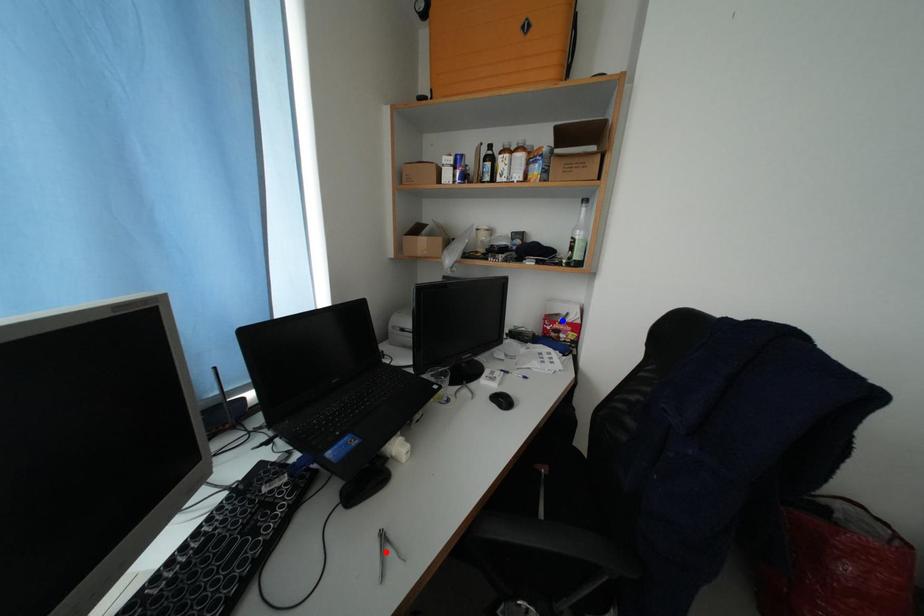
Question: Two points are marked on the image. Which point is closer to the camera?

Choices:
 (A) Blue point is closer.
 (B) Red point is closer.

Answer: (B)